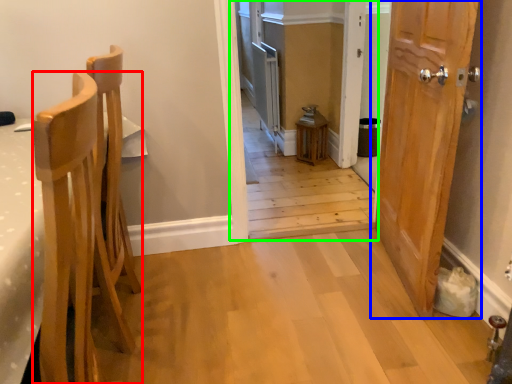
Question: Which is farther away from chair (highlighted by a red box)? door (highlighted by a blue box) or corridor (highlighted by a green box)?

Choices:
 (A) door
 (B) corridor

Answer: (B)